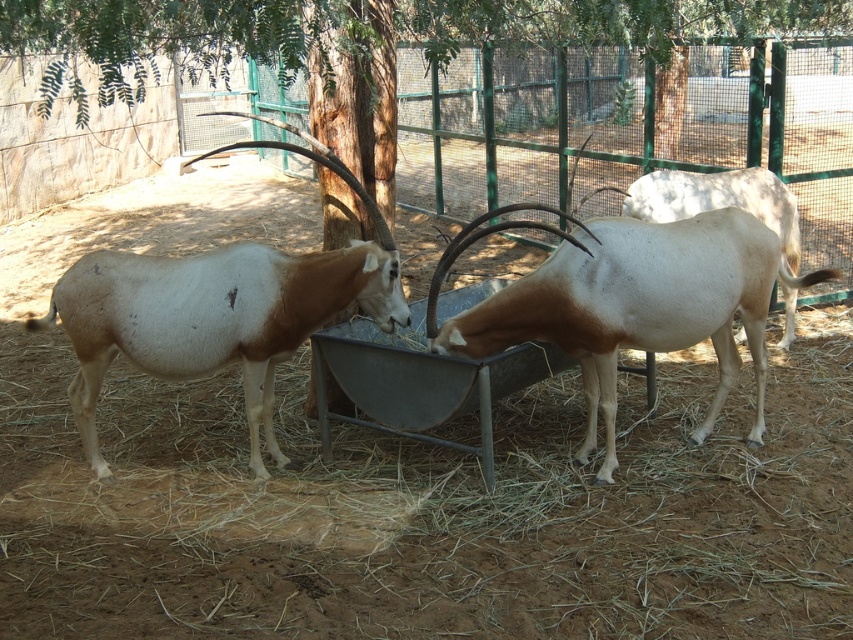
Question: Which object is farther from the camera taking this photo?

Choices:
 (A) white glossy antelope at center
 (B) brown and white antelope at left

Answer: (B)

Question: Among these points, which one is nearest to the camera?

Choices:
 (A) (136, 276)
 (B) (656, 310)

Answer: (B)

Question: Does brown and white antelope at left appear over white glossy antelope at center?

Choices:
 (A) no
 (B) yes

Answer: (A)

Question: Does brown and white antelope at left appear under white glossy antelope at center?

Choices:
 (A) no
 (B) yes

Answer: (B)

Question: Does brown and white antelope at left have a lesser width compared to white glossy antelope at center?

Choices:
 (A) no
 (B) yes

Answer: (B)